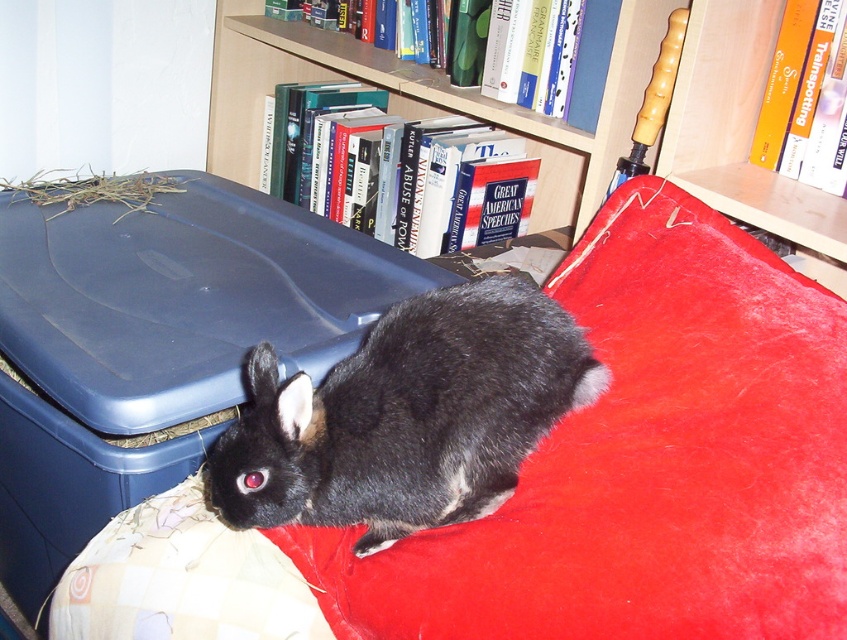
Question: Among these points, which one is farthest from the camera?

Choices:
 (A) (258, 509)
 (B) (623, 131)
 (C) (574, 500)

Answer: (B)

Question: Which object is farther from the camera taking this photo?

Choices:
 (A) wooden bookshelf at upper center
 (B) black fur rabbit at center
 (C) velvet red pillow at lower center

Answer: (A)

Question: Is black fur rabbit at center positioned behind wooden bookshelf at upper center?

Choices:
 (A) no
 (B) yes

Answer: (A)

Question: Is velvet red pillow at lower center positioned before wooden bookshelf at upper center?

Choices:
 (A) no
 (B) yes

Answer: (B)

Question: Which point appears farthest from the camera in this image?

Choices:
 (A) (413, 518)
 (B) (817, 205)
 (C) (585, 326)

Answer: (B)

Question: Does velvet red pillow at lower center have a larger size compared to black fur rabbit at center?

Choices:
 (A) no
 (B) yes

Answer: (B)